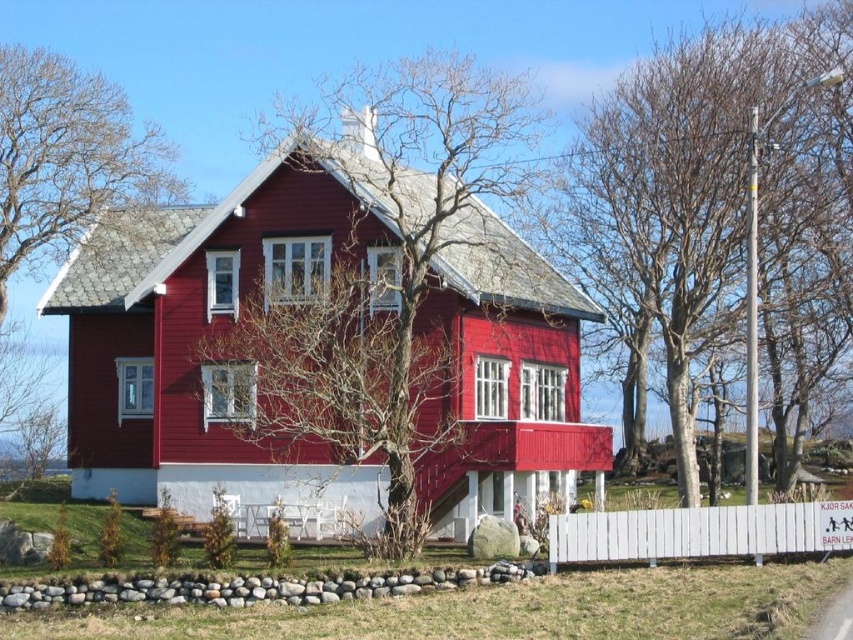
Does bare wood tree at center appear on the left side of white wooden fence at lower right?

Correct, you'll find bare wood tree at center to the left of white wooden fence at lower right.

Which is more to the right, bare wood tree at center or white wooden fence at lower right?

Positioned to the right is white wooden fence at lower right.

In order to click on bare wood tree at center in this screenshot , I will do `click(384, 282)`.

Between bare branches at upper center and white wooden fence at lower right, which one has less height?

Standing shorter between the two is white wooden fence at lower right.

Does bare branches at upper center have a greater height compared to white wooden fence at lower right?

Indeed, bare branches at upper center has a greater height compared to white wooden fence at lower right.

Does point (691, 188) come behind point (663, 545)?

Yes.

Image resolution: width=853 pixels, height=640 pixels. What are the coordinates of `bare branches at upper center` in the screenshot? It's located at (674, 195).

Does bare branches at upper left come in front of white wooden fence at lower right?

No, it is not.

Between point (90, 120) and point (579, 532), which one is positioned in front?

Point (579, 532)

Where is `bare branches at upper left`? The height and width of the screenshot is (640, 853). bare branches at upper left is located at coordinates (67, 157).